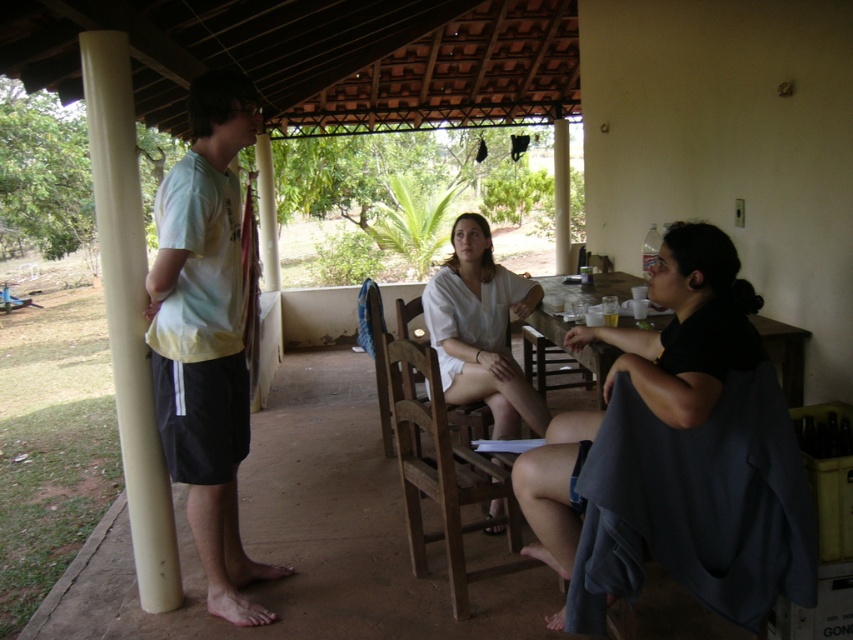
Who is higher up, wooden chair at center or wooden table at center?

Positioned higher is wooden table at center.

Which is more to the right, wooden chair at center or wooden table at center?

From the viewer's perspective, wooden table at center appears more on the right side.

Between point (427, 458) and point (538, 321), which one is positioned in front?

Point (427, 458) is more forward.

The width and height of the screenshot is (853, 640). I want to click on wooden chair at center, so click(x=444, y=474).

Does light yellow t-shirt at left have a larger size compared to dark gray fabric at right?

Actually, light yellow t-shirt at left might be smaller than dark gray fabric at right.

Is point (193, 372) positioned after point (691, 323)?

Yes, it is.

In order to click on light yellow t-shirt at left in this screenshot , I will do `click(206, 337)`.

Where is `light yellow t-shirt at left`? light yellow t-shirt at left is located at coordinates (206, 337).

Between point (743, 596) and point (793, 353), which one is positioned behind?

Positioned behind is point (793, 353).

Is point (660, 493) farther from camera compared to point (564, 330)?

No, (660, 493) is in front of (564, 330).

You are a GUI agent. You are given a task and a screenshot of the screen. Output one action in this format:
    pyautogui.click(x=<x>, y=<y>)
    Task: Click on the dark gray fabric at lower right
    Image resolution: width=853 pixels, height=640 pixels.
    Given the screenshot: What is the action you would take?
    pyautogui.click(x=695, y=506)